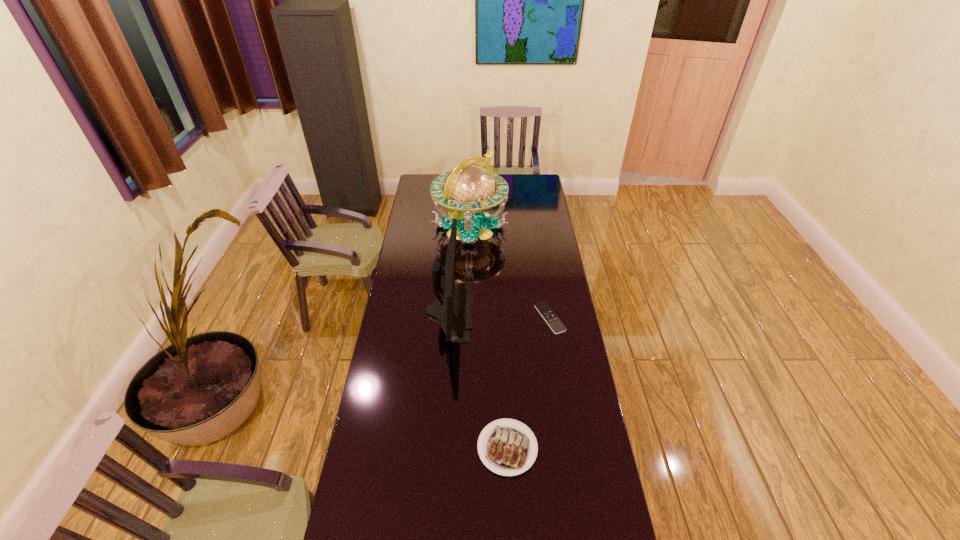
At what (x,y) coordinates should I click in order to perform the action: click on free point between the nearest object and the farthest object. Please return your answer as a coordinate pair (x, y). Looking at the image, I should click on (489, 337).

Identify the location of free space between the remote control and the plate. This screenshot has height=540, width=960. (529, 383).

This screenshot has height=540, width=960. I want to click on free area in between the tallest object and the monitor, so click(x=460, y=269).

The height and width of the screenshot is (540, 960). What are the coordinates of `empty space between the plate and the remote control` in the screenshot? It's located at (529, 383).

The height and width of the screenshot is (540, 960). Identify the location of free space that is in between the shortest object and the third tallest object. 529,383.

Locate an element on the screen. the closest object to the monitor is located at coordinates (469, 188).

Identify which object is located as the second nearest to the tallest object. Please provide its 2D coordinates. Your answer should be formatted as a tuple, i.e. [(x, y)], where the tuple contains the x and y coordinates of a point satisfying the conditions above.

[(544, 309)]

At what (x,y) coordinates should I click in order to perform the action: click on vacant area that satisfies the following two spatial constraints: 1. on the screen side of the third shortest object; 2. on the left side of the plate. Please return your answer as a coordinate pair (x, y). The width and height of the screenshot is (960, 540). Looking at the image, I should click on (441, 448).

The height and width of the screenshot is (540, 960). Find the location of `vacant space that satisfies the following two spatial constraints: 1. on the front side of the globe; 2. on the screen side of the second tallest object`. vacant space that satisfies the following two spatial constraints: 1. on the front side of the globe; 2. on the screen side of the second tallest object is located at coordinates (468, 312).

Locate an element on the screen. The width and height of the screenshot is (960, 540). vacant space that satisfies the following two spatial constraints: 1. on the front side of the globe; 2. on the left side of the nearest object is located at coordinates (464, 448).